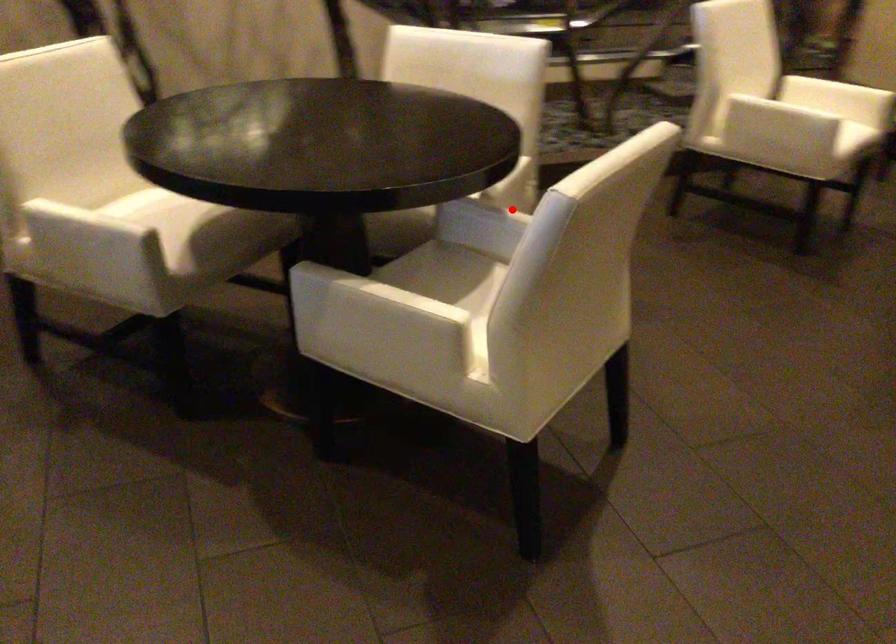
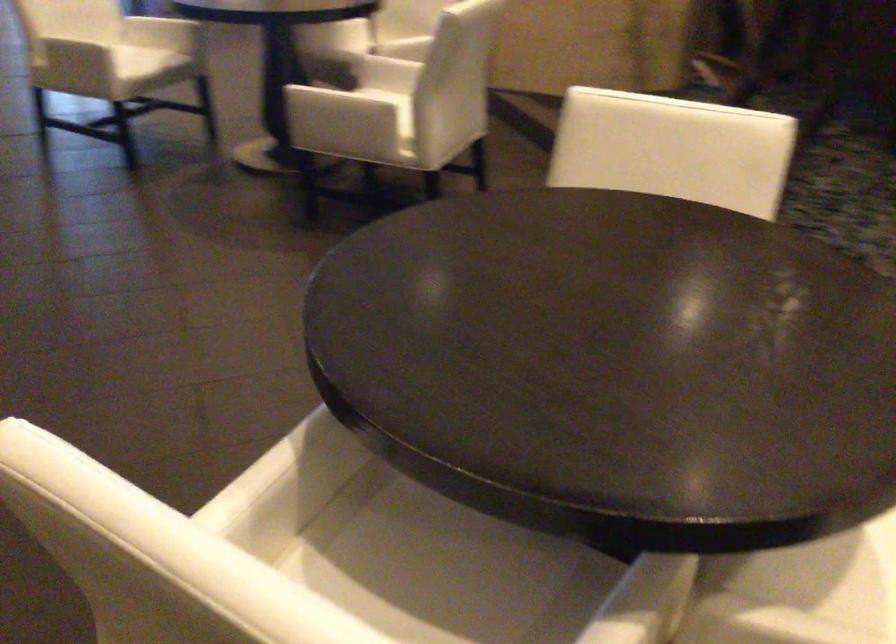
Where in the second image is the point corresponding to the highlighted location from the first image?

(616, 630)